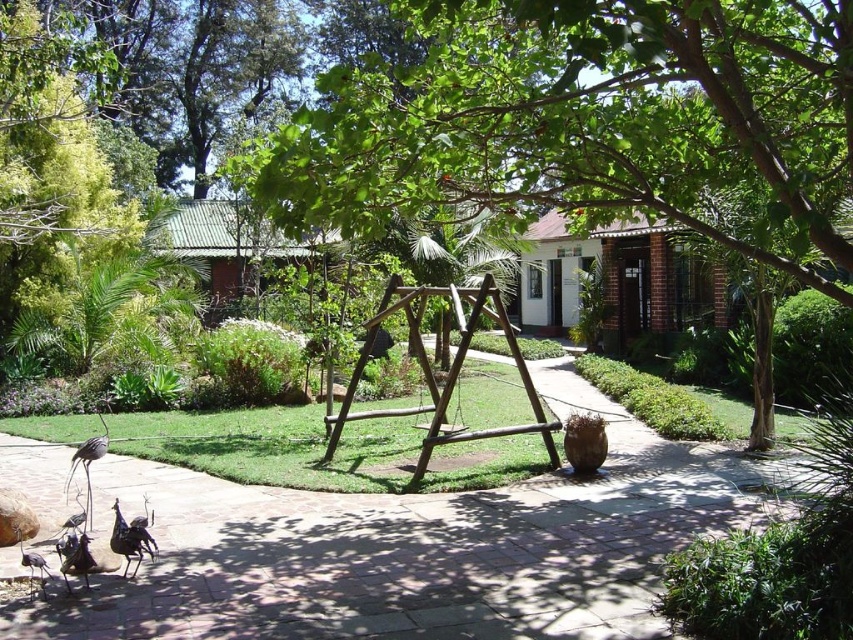
Between green leafy tree at center and paved stone path at center, which one has less height?

With less height is paved stone path at center.

Who is more distant from viewer, (709, 88) or (613, 433)?

Positioned behind is point (613, 433).

Does point (521, 109) come farther from viewer compared to point (297, 502)?

No, (521, 109) is closer to viewer.

You are a GUI agent. You are given a task and a screenshot of the screen. Output one action in this format:
    pyautogui.click(x=<x>, y=<y>)
    Task: Click on the green leafy tree at center
    The height and width of the screenshot is (640, 853).
    Given the screenshot: What is the action you would take?
    pyautogui.click(x=589, y=122)

Does paved stone path at center come behind brown wooden swing at center?

No, paved stone path at center is closer to the viewer.

The width and height of the screenshot is (853, 640). Find the location of `paved stone path at center`. paved stone path at center is located at coordinates (416, 547).

Looking at this image, measure the distance between green leafy tree at center and brown wooden swing at center.

The distance of green leafy tree at center from brown wooden swing at center is 4.53 meters.

Does green leafy tree at center lie in front of brown wooden swing at center?

Yes.

In order to click on green leafy tree at center in this screenshot , I will do `click(589, 122)`.